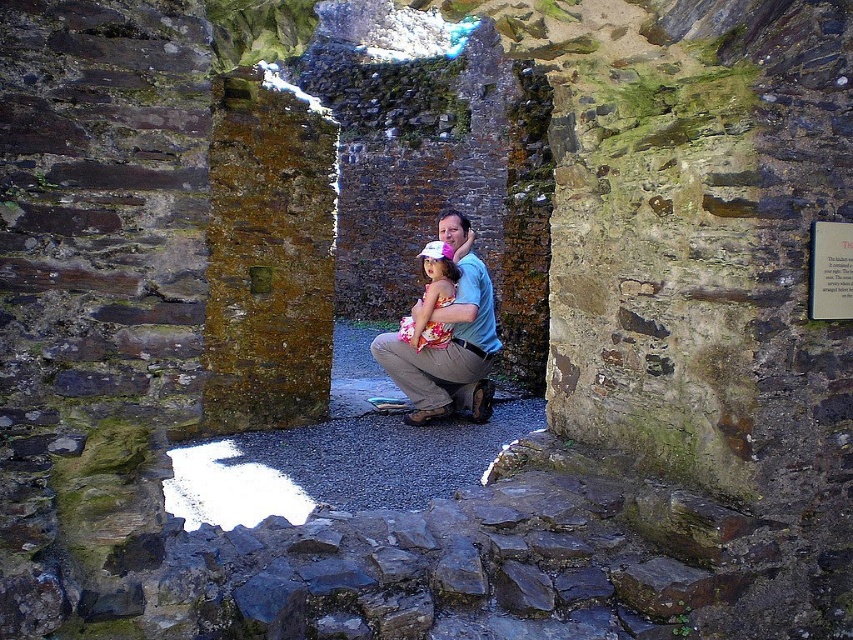
Is matte blue shirt at center shorter than floral dress at center?

In fact, matte blue shirt at center may be taller than floral dress at center.

Is matte blue shirt at center taller than floral dress at center?

Yes, matte blue shirt at center is taller than floral dress at center.

Locate an element on the screen. This screenshot has height=640, width=853. matte blue shirt at center is located at coordinates click(x=448, y=342).